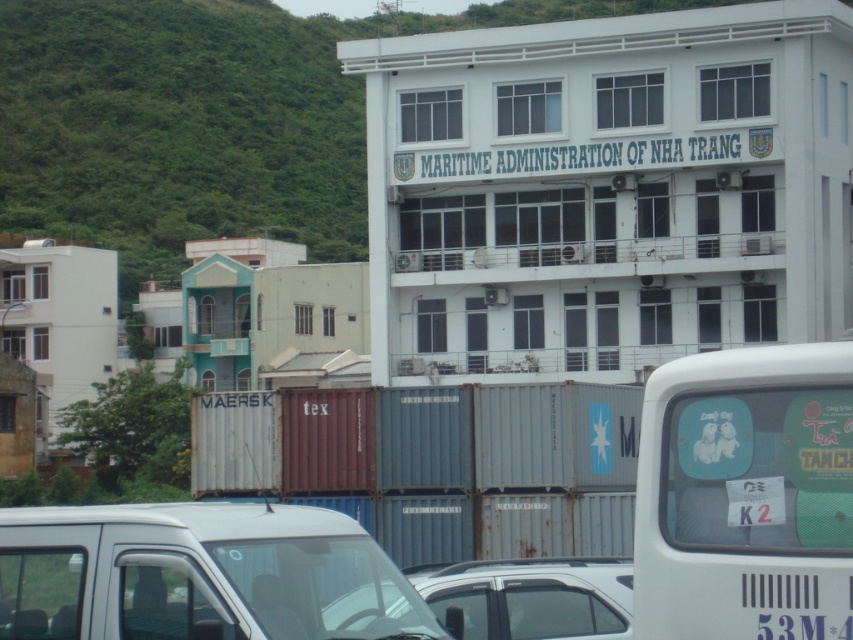
Looking at this image, you are standing in front of the Maritime Administration building and want to locate two specific points marked on a map. The first point is at coordinates point (704, 506) and the second is at point (460, 570). Based on the scene description, which point is closer to you?

Point (704, 506) is in front of point (460, 570), so the first point is closer to you.

You are standing in front of the Maritime Administration building and want to take a photo that includes both the point at coordinates point (163, 532) and point (590, 604). Which point will appear larger in your photo?

Point (163, 532) is closer to the camera than point (590, 604), so it will appear larger in the photo.